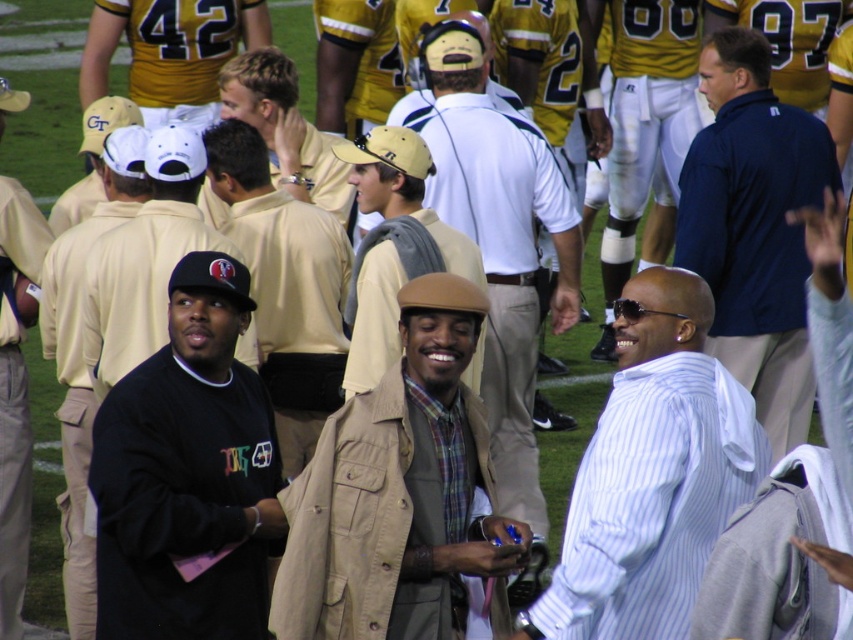
Question: Which of the following is the closest to the observer?

Choices:
 (A) light brown leather jacket at center
 (B) navy blue shirt at upper right
 (C) white striped shirt at center

Answer: (C)

Question: Which point is closer to the camera taking this photo?

Choices:
 (A) (221, 593)
 (B) (286, 74)
 (C) (38, 628)

Answer: (A)

Question: Is black matte sweatshirt at center bigger than light brown leather jacket at center?

Choices:
 (A) yes
 (B) no

Answer: (B)

Question: Among these objects, which one is farthest from the camera?

Choices:
 (A) navy blue shirt at upper right
 (B) khaki uniform pants at center

Answer: (A)

Question: Is black matte sweatshirt at center to the right of light brown leather jacket at center from the viewer's perspective?

Choices:
 (A) yes
 (B) no

Answer: (B)

Question: Considering the relative positions of khaki uniform pants at center and light brown leather jacket at center in the image provided, where is khaki uniform pants at center located with respect to light brown leather jacket at center?

Choices:
 (A) above
 (B) below

Answer: (B)